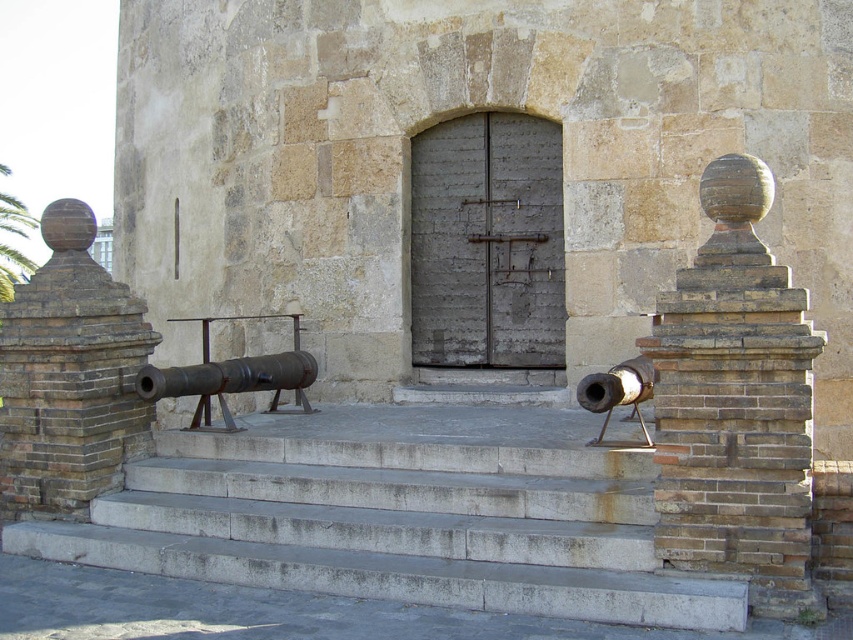
Is point (699, 529) closer to camera compared to point (35, 509)?

Yes, it is in front of point (35, 509).

Is brick textured pillar at right bigger than brown brick pillar at left?

Actually, brick textured pillar at right might be smaller than brown brick pillar at left.

Find the location of a particular element. This screenshot has height=640, width=853. brick textured pillar at right is located at coordinates (735, 404).

Identify the location of brick textured pillar at right. The image size is (853, 640). (735, 404).

Is gray concrete stairs at center closer to the viewer compared to rusty metal cannon at center?

That is True.

Is gray concrete stairs at center shorter than rusty metal cannon at center?

In fact, gray concrete stairs at center may be taller than rusty metal cannon at center.

Is point (561, 509) positioned before point (158, 396)?

Yes.

The width and height of the screenshot is (853, 640). I want to click on gray concrete stairs at center, so pos(396,525).

Consider the image. Does gray concrete stairs at center come behind brown brick pillar at left?

No, gray concrete stairs at center is closer to the viewer.

Is gray concrete stairs at center smaller than brown brick pillar at left?

Incorrect, gray concrete stairs at center is not smaller in size than brown brick pillar at left.

Is point (544, 593) more distant than point (3, 416)?

That is False.

Locate an element on the screen. The height and width of the screenshot is (640, 853). gray concrete stairs at center is located at coordinates (396, 525).